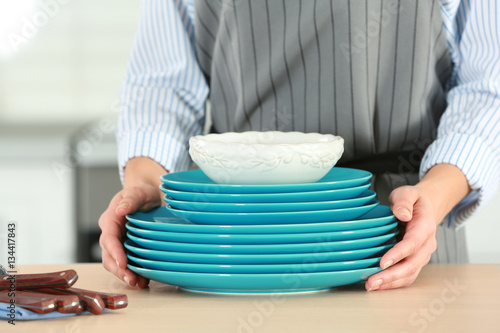
Where is `blue plates`? The height and width of the screenshot is (333, 500). blue plates is located at coordinates (260, 188), (261, 194), (259, 205), (267, 215), (271, 227), (271, 238), (275, 246), (275, 257), (276, 266), (277, 280).